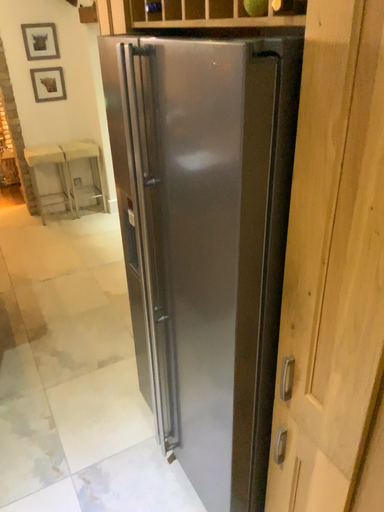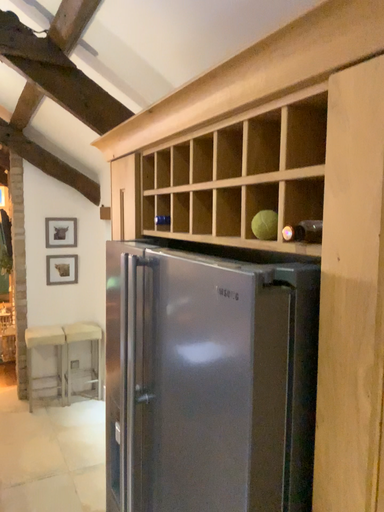
Question: Which way did the camera rotate in the video?

Choices:
 (A) rotated upward
 (B) rotated downward

Answer: (A)